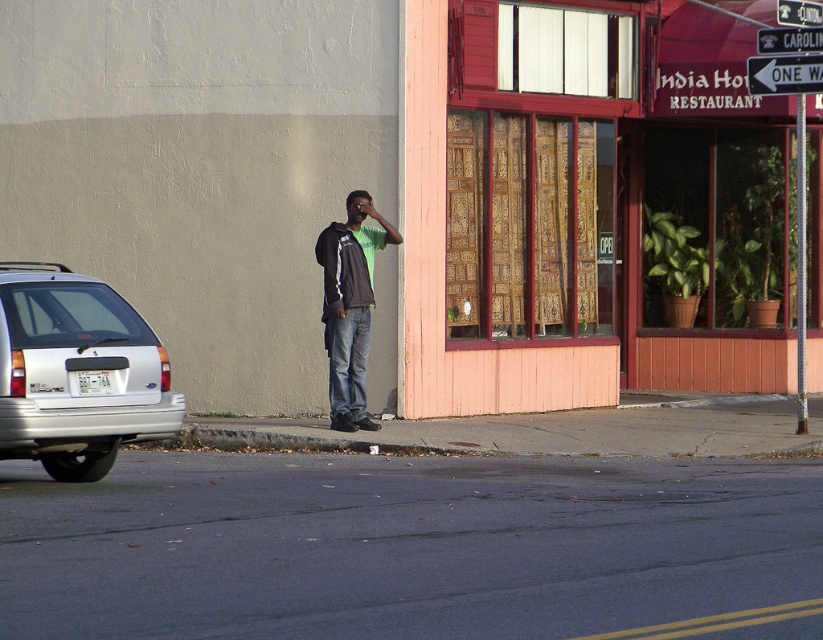
Question: Does silver metallic hatchback at left appear under black plastic one way sign at upper right?

Choices:
 (A) no
 (B) yes

Answer: (B)

Question: In this image, where is silver metallic hatchback at left located relative to brown jacket at center?

Choices:
 (A) below
 (B) above

Answer: (A)

Question: Which point is closer to the camera?

Choices:
 (A) (x=110, y=460)
 (B) (x=810, y=64)

Answer: (A)

Question: Which point is farther from the camera taking this photo?

Choices:
 (A) (36, 336)
 (B) (746, 132)

Answer: (B)

Question: In this image, where is silver metallic hatchback at left located relative to brown jacket at center?

Choices:
 (A) right
 (B) left

Answer: (B)

Question: Estimate the real-world distances between objects in this image. Which object is farther from the brown jacket at center?

Choices:
 (A) pink wood/paneling at center
 (B) black plastic one way sign at upper right
 (C) silver metallic hatchback at left

Answer: (A)